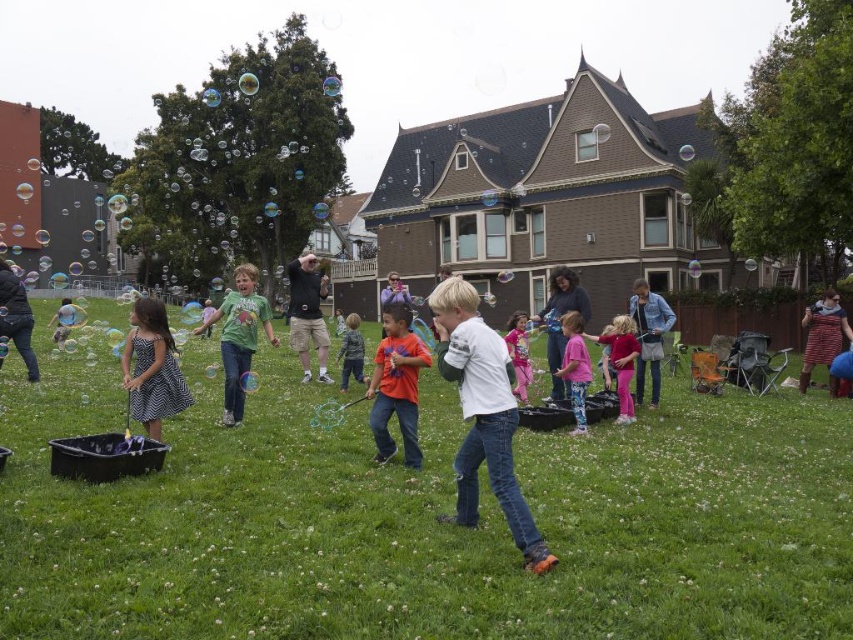
In the scene shown: You are a photographer trying to capture a photo of both the polka dot dress at left and the pink fabric shirt at center. Since you want to include both in the frame, which clothing item should you focus on first to ensure both are in the shot?

You should focus on the polka dot dress at left first because it is located above the pink fabric shirt at center, so adjusting the camera angle to capture the higher positioned dress will naturally include the lower positioned shirt in the frame.